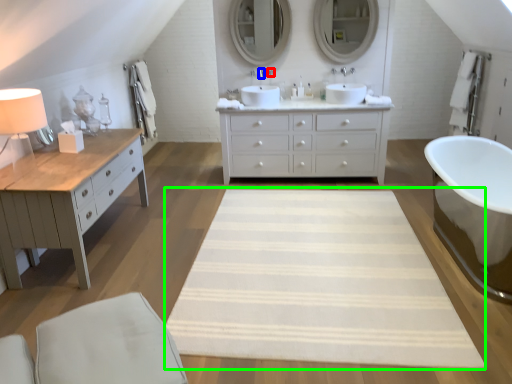
Question: Based on their relative distances, which object is nearer to faucet (highlighted by a red box)? Choose from faucet (highlighted by a blue box) and mat (highlighted by a green box).

Choices:
 (A) faucet
 (B) mat

Answer: (A)